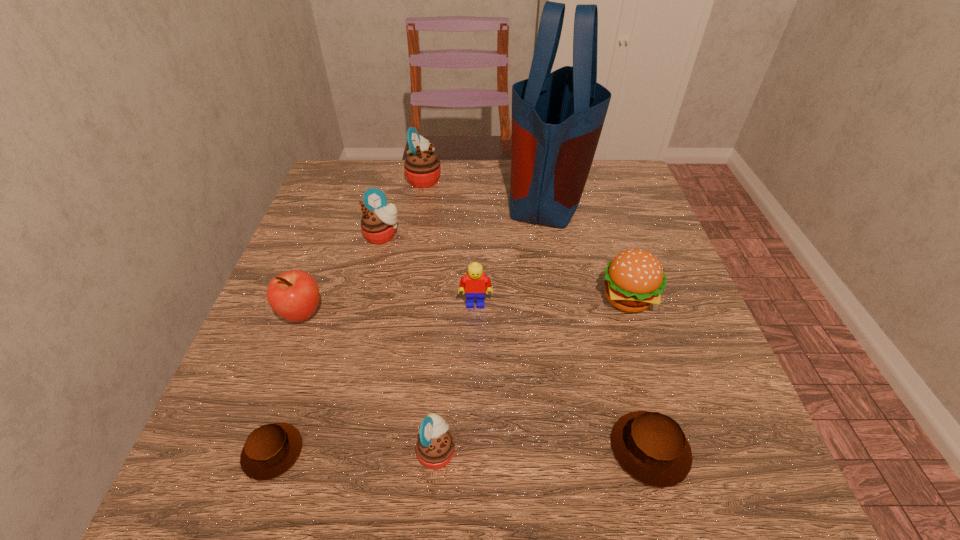
Locate an element on the screen. Image resolution: width=960 pixels, height=540 pixels. object that is at the near left corner is located at coordinates (270, 450).

Locate an element on the screen. The width and height of the screenshot is (960, 540). object that is at the far right corner is located at coordinates (557, 117).

Locate an element on the screen. object that is at the near right corner is located at coordinates (651, 447).

Where is `vacant space at the near edge`? This screenshot has width=960, height=540. vacant space at the near edge is located at coordinates (501, 509).

In the image, there is a desktop. Identify the location of vacant region at the left edge. The height and width of the screenshot is (540, 960). (353, 291).

At what (x,y) coordinates should I click in order to perform the action: click on vacant area at the right edge of the desktop. Please return your answer as a coordinate pair (x, y). The height and width of the screenshot is (540, 960). Looking at the image, I should click on (684, 307).

The width and height of the screenshot is (960, 540). In the image, there is a desktop. What are the coordinates of `blank space at the far left corner` in the screenshot? It's located at click(x=365, y=176).

Find the location of a particular element. This screenshot has height=540, width=960. vacant space at the near left corner is located at coordinates click(208, 467).

Identify the location of vacant region at the far right corner of the desktop. This screenshot has width=960, height=540. (621, 172).

Identify the location of blank space at the near right corner of the desktop. (746, 469).